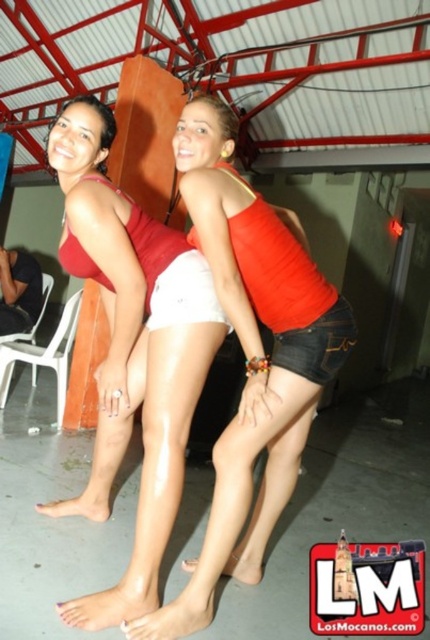
Question: Which is farther from the white fabric shorts at center?

Choices:
 (A) matte red tank top at center
 (B) white denim shorts at center

Answer: (B)

Question: Is white denim shorts at center smaller than white fabric shorts at center?

Choices:
 (A) yes
 (B) no

Answer: (B)

Question: Among these objects, which one is farthest from the camera?

Choices:
 (A) white fabric shorts at center
 (B) matte red tank top at center
 (C) white denim shorts at center

Answer: (A)

Question: Which point appears closest to the camera in this image?

Choices:
 (A) (239, 337)
 (B) (68, 193)
 (C) (150, 307)

Answer: (A)

Question: Is white denim shorts at center thinner than white fabric shorts at center?

Choices:
 (A) yes
 (B) no

Answer: (B)

Question: Is the position of matte red tank top at center more distant than that of white fabric shorts at center?

Choices:
 (A) yes
 (B) no

Answer: (B)